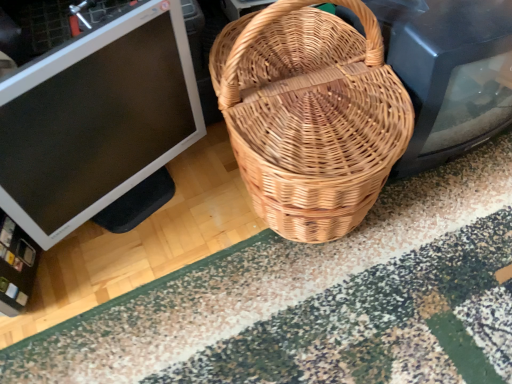
This screenshot has width=512, height=384. In order to click on vacant space to the left of natural woven picnic basket at center in this screenshot , I will do `click(164, 248)`.